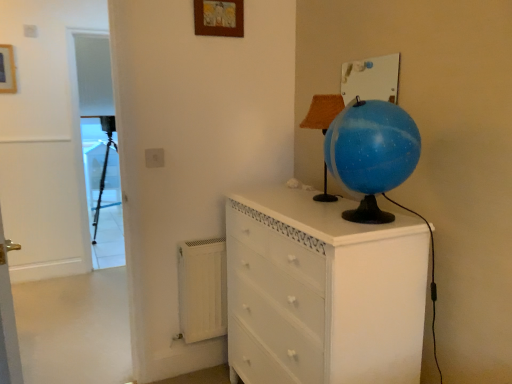
Locate an element on the screen. vacant space underneath blue glossy globe at upper right (from a real-world perspective) is located at coordinates click(x=372, y=213).